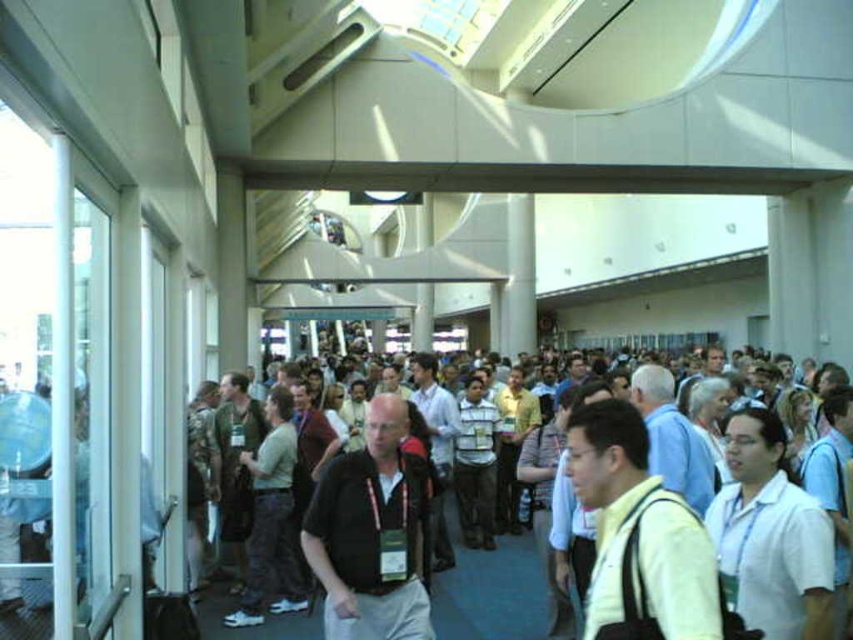
You are organizing a photo shoot in this convention center and want to ensure both the matte black shirt at center and the yellow matte shirt at center are clearly visible in the frame. Considering their sizes, which shirt should you focus on first to ensure it fits within the camera frame?

The matte black shirt at center is larger than the yellow matte shirt at center, so you should focus on positioning the matte black shirt at center first to ensure it fits within the camera frame.